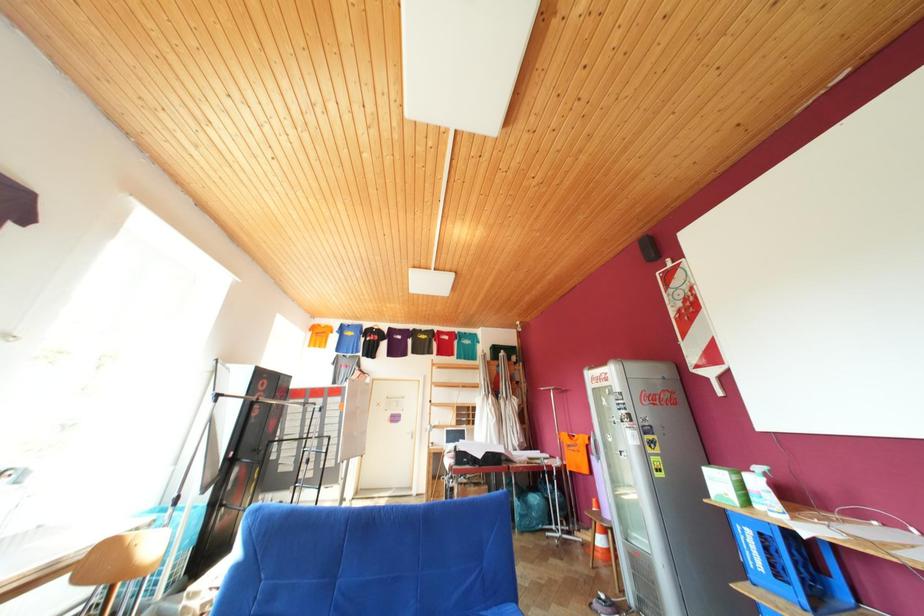
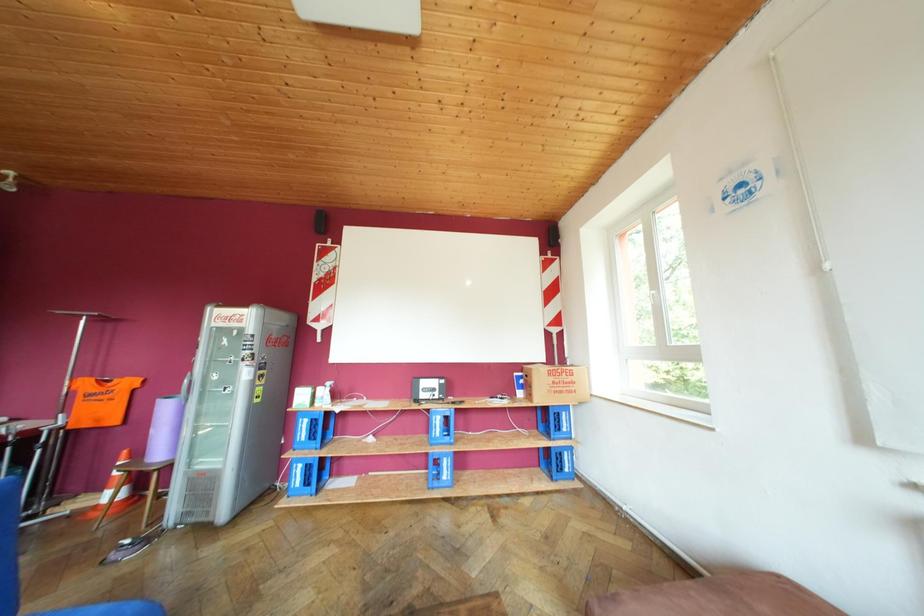
Question: The first image is from the beginning of the video and the second image is from the end. How did the camera likely rotate when shooting the video?

Choices:
 (A) Left
 (B) Right
 (C) Up
 (D) Down

Answer: (B)